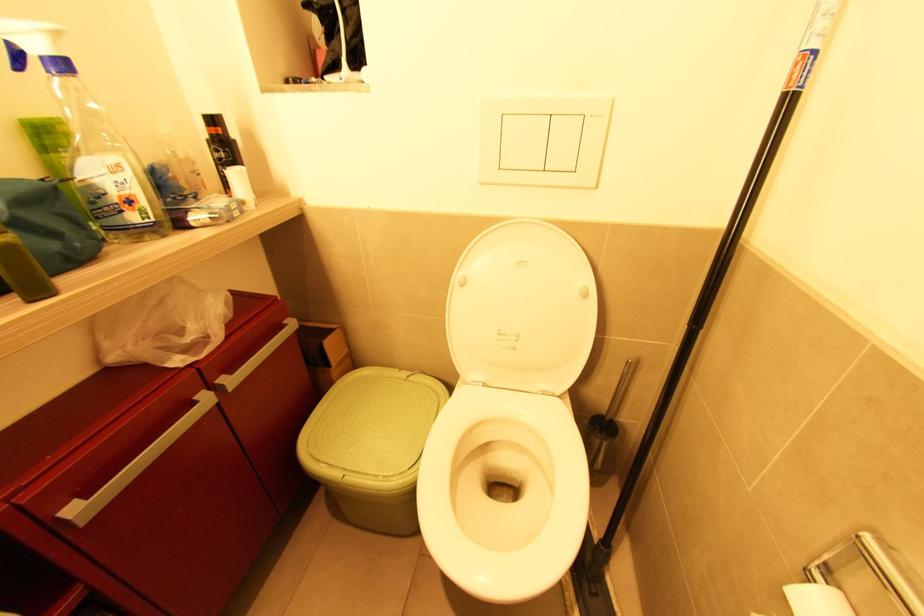
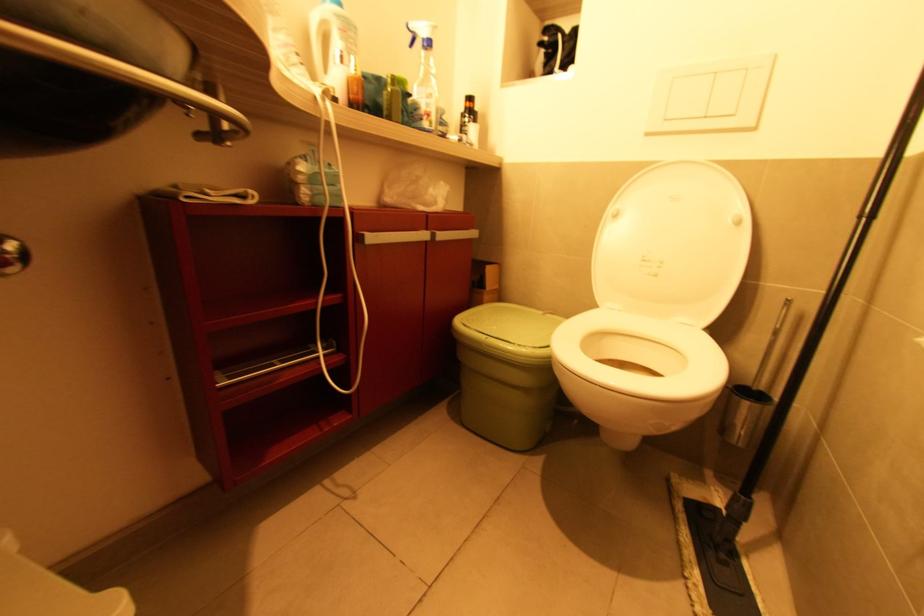
Find the pixel in the second image that matches pixel 207 400 in the first image.

(426, 237)